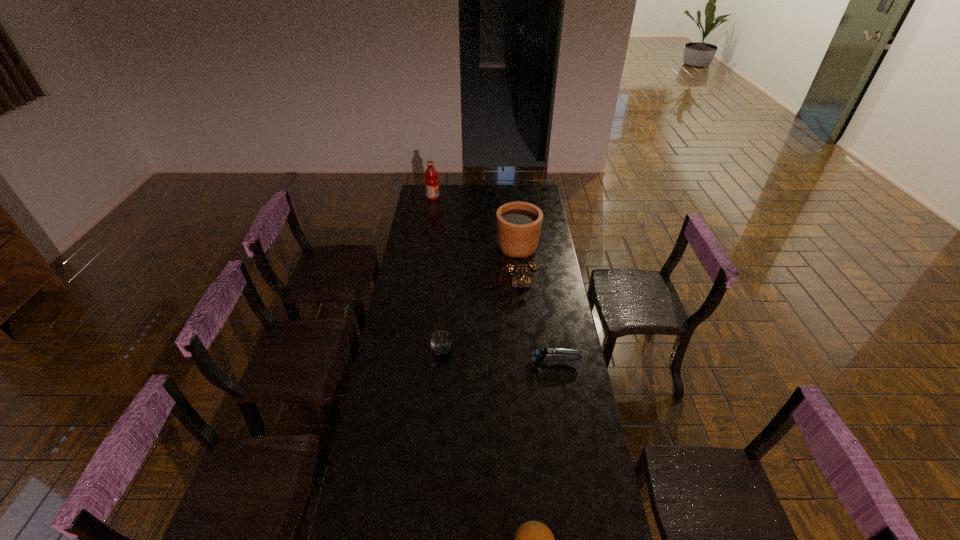
The width and height of the screenshot is (960, 540). I want to click on object at the far left corner, so click(431, 182).

This screenshot has width=960, height=540. What are the coordinates of `free space at the far edge of the desktop` in the screenshot? It's located at (489, 201).

In the image, there is a desktop. What are the coordinates of `blank space at the left edge` in the screenshot? It's located at (398, 287).

What are the coordinates of `vacant space at the right edge` in the screenshot? It's located at (x=549, y=269).

This screenshot has height=540, width=960. I want to click on empty space that is in between the telephone and the second farthest object, so click(513, 266).

The image size is (960, 540). Identify the location of free space between the fruit juice and the third farthest object. (470, 241).

Identify the location of free area in between the fourth nearest object and the telephoto lens. (475, 318).

Locate an element on the screen. free point between the fruit juice and the third farthest object is located at coordinates (470, 241).

Find the location of `vacant space in between the telephoto lens and the flowerpot`. vacant space in between the telephoto lens and the flowerpot is located at coordinates (480, 299).

The image size is (960, 540). I want to click on empty space that is in between the telephoto lens and the electric shaver, so click(x=499, y=356).